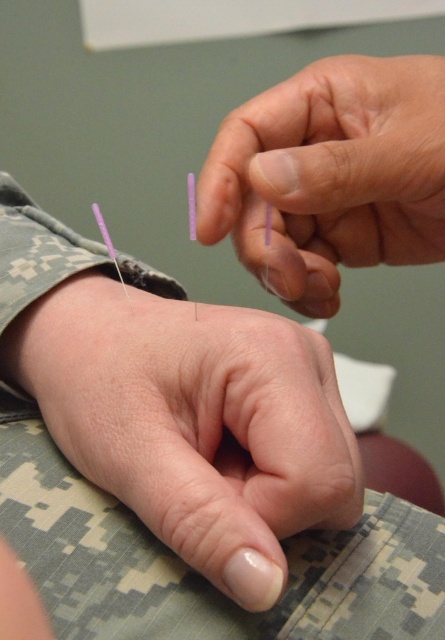
You are a medical student observing an acupuncture session. You notice the transparent plastic needles at upper center and the purple matte needle at wrist. Which object is nearer to you?

The transparent plastic needles at upper center are closer to the viewer than the purple matte needle at wrist.

You are a medical student observing an acupuncture session. You notice two needles in the scene. One is the transparent plastic needles at upper center and the other is the purple matte needle at wrist. Which needle is longer?

The transparent plastic needles at upper center is much taller than the purple matte needle at wrist, so the transparent plastic needles at upper center is longer.